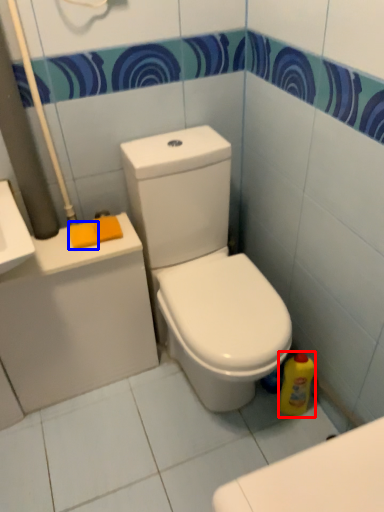
Question: Among these objects, which one is farthest to the camera, cleaning product (highlighted by a red box) or soap (highlighted by a blue box)?

Choices:
 (A) cleaning product
 (B) soap

Answer: (A)